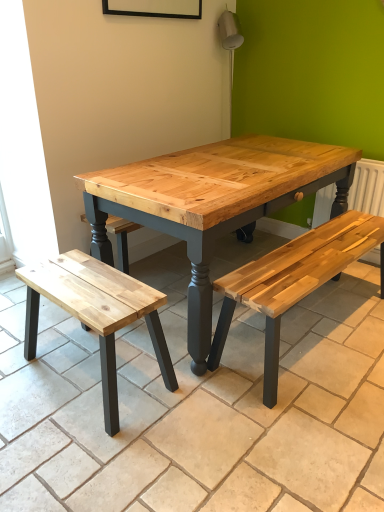
Where is `free location to the right of natural wood bench at lower left`? The image size is (384, 512). free location to the right of natural wood bench at lower left is located at coordinates (212, 386).